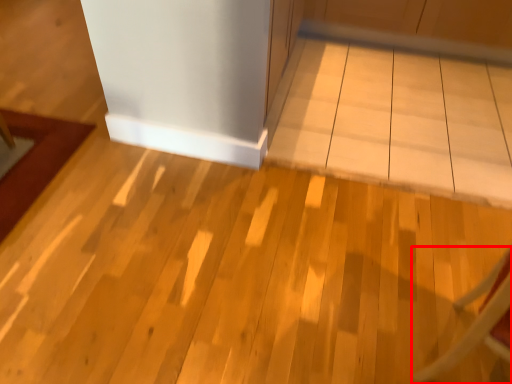
Question: Considering the relative positions of furniture (annotated by the red box) and table in the image provided, where is furniture (annotated by the red box) located with respect to the staircase?

Choices:
 (A) right
 (B) left

Answer: (A)